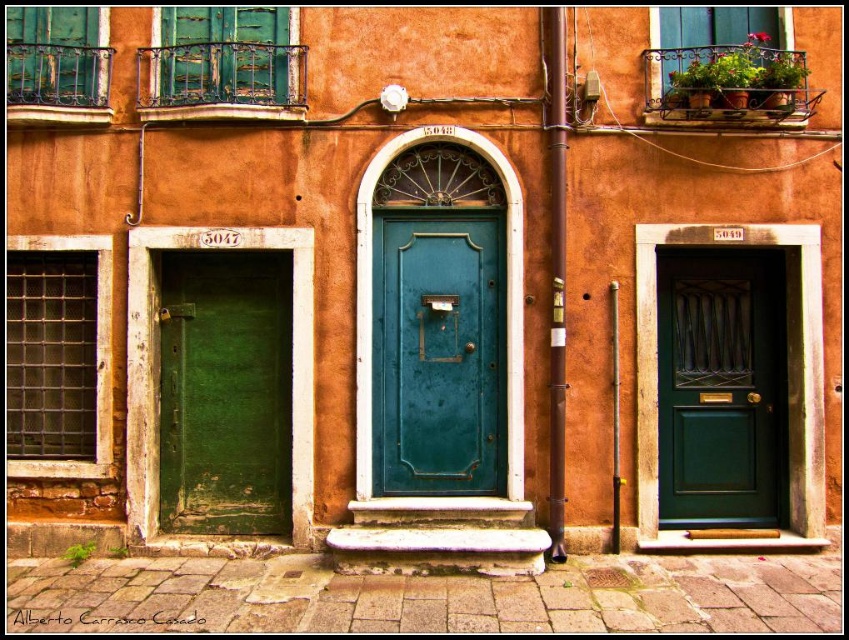
Question: Does teal matte door at center appear on the left side of green matte door at left?

Choices:
 (A) no
 (B) yes

Answer: (A)

Question: Can you confirm if green matte door at left is positioned to the right of green matte door at center?

Choices:
 (A) no
 (B) yes

Answer: (A)

Question: Which point is farther to the camera?

Choices:
 (A) (429, 440)
 (B) (249, 410)
 (C) (690, 337)

Answer: (C)

Question: Which object is farther from the camera taking this photo?

Choices:
 (A) teal matte door at center
 (B) green matte door at left
 (C) green matte door at center

Answer: (C)

Question: Which of the following is the farthest from the observer?

Choices:
 (A) (728, 497)
 (B) (377, 221)

Answer: (A)

Question: Can you confirm if teal matte door at center is positioned below green matte door at center?

Choices:
 (A) no
 (B) yes

Answer: (A)